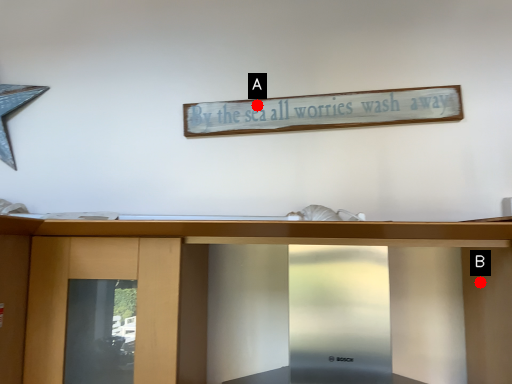
Question: Two points are circled on the image, labeled by A and B beside each circle. Which of the following is the farthest from the observer?

Choices:
 (A) A is further
 (B) B is further

Answer: (A)